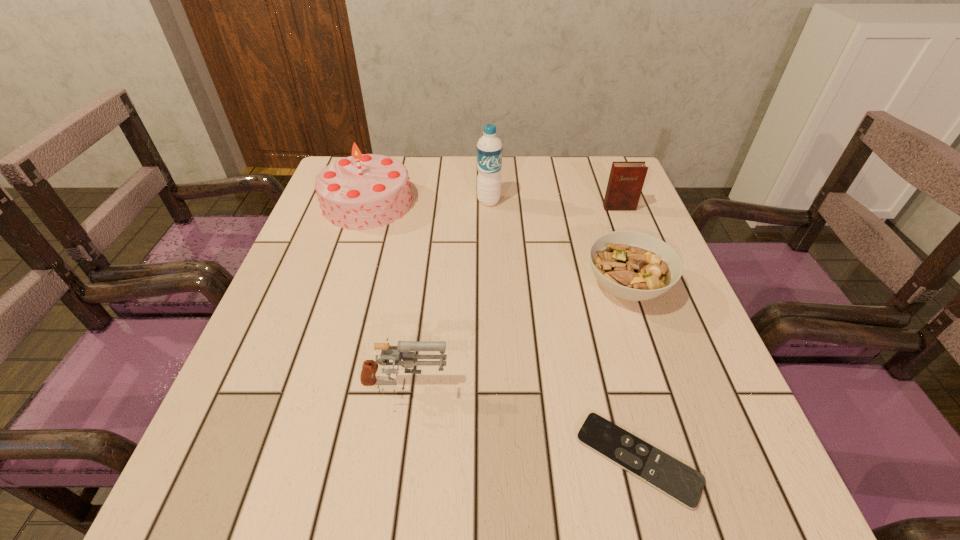
You are a GUI agent. You are given a task and a screenshot of the screen. Output one action in this format:
    pyautogui.click(x=<x>, y=<y>)
    Task: Click on the free space that is in between the gun and the tallest object
    The height and width of the screenshot is (540, 960).
    Given the screenshot: What is the action you would take?
    pyautogui.click(x=446, y=295)

You are a GUI agent. You are given a task and a screenshot of the screen. Output one action in this format:
    pyautogui.click(x=<x>, y=<y>)
    Task: Click on the vacant point located between the shortest object and the fifth farthest object
    The height and width of the screenshot is (540, 960).
    Given the screenshot: What is the action you would take?
    pyautogui.click(x=521, y=423)

Image resolution: width=960 pixels, height=540 pixels. I want to click on free space between the tallest object and the stew, so click(x=558, y=244).

Image resolution: width=960 pixels, height=540 pixels. Find the location of `vacant area that lies between the stew and the gun`. vacant area that lies between the stew and the gun is located at coordinates (516, 338).

The image size is (960, 540). I want to click on free space between the fourth farthest object and the fourth tallest object, so click(x=516, y=338).

Find the location of a particular element. This screenshot has height=540, width=960. unoccupied area between the second nearest object and the remote control is located at coordinates (521, 423).

This screenshot has height=540, width=960. What are the coordinates of `free area in between the shortest object and the tallest object` in the screenshot? It's located at (564, 330).

I want to click on object that stands as the fourth closest to the remote control, so coord(364,191).

Where is `object that is the fifth closest one to the birthday cake`? This screenshot has height=540, width=960. object that is the fifth closest one to the birthday cake is located at coordinates pyautogui.click(x=685, y=485).

In order to click on free region that satisfies the following two spatial constraints: 1. at the barrel end of the fourth tallest object; 2. on the back side of the shortest object in this screenshot , I will do `click(395, 459)`.